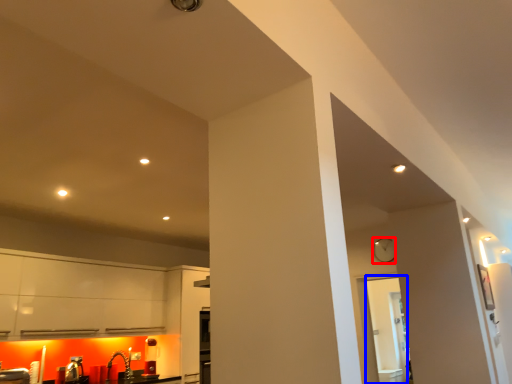
Question: Which object is further to the camera taking this photo, clock (highlighted by a red box) or glass door (highlighted by a blue box)?

Choices:
 (A) clock
 (B) glass door

Answer: (A)